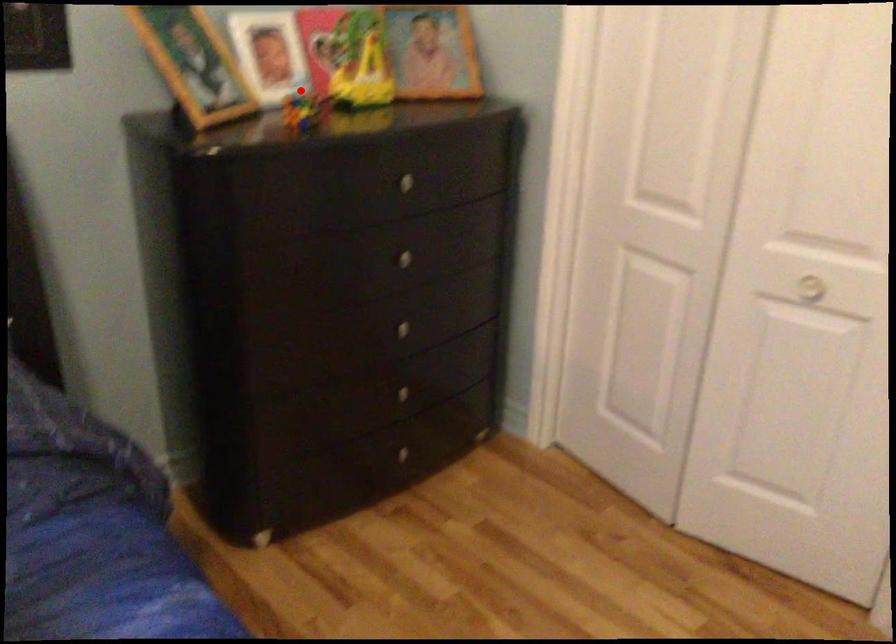
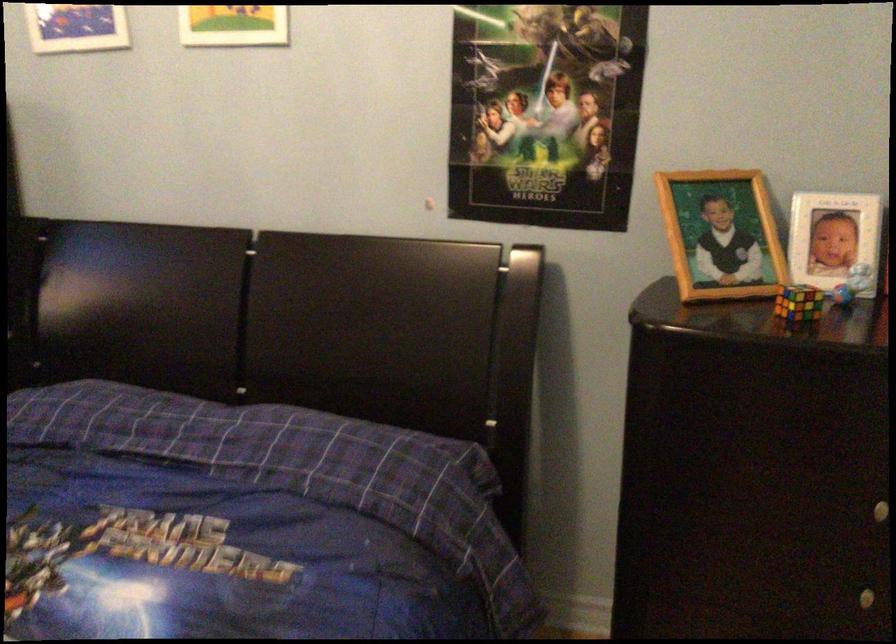
Question: I am providing you with two images of the same scene from different viewpoints. A red point is marked on the first image. At the location where the point appears in image 1, is it still visible in image 2?

Choices:
 (A) Yes
 (B) No

Answer: (A)